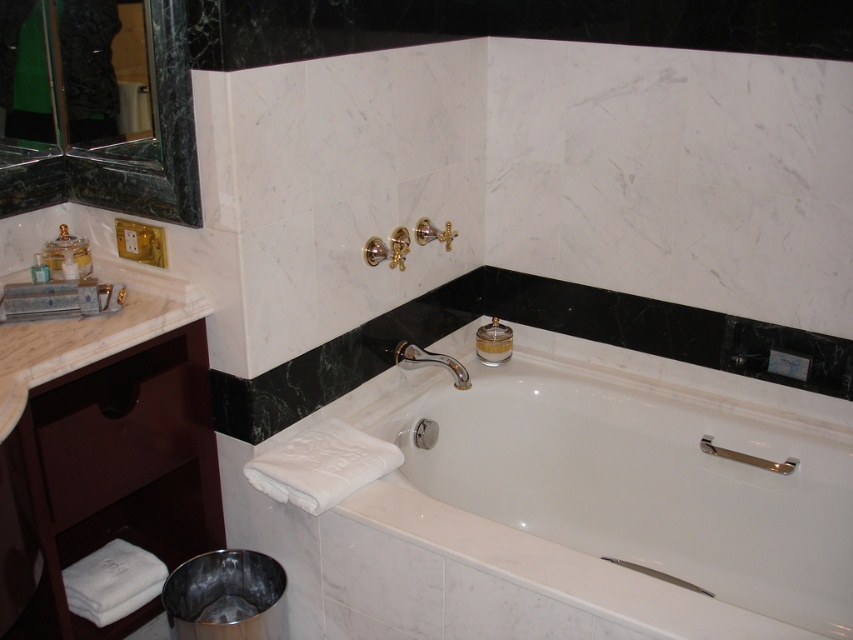
Which is above, white glossy bathtub at center or chrome metallic grab bar at lower right?

chrome metallic grab bar at lower right

What do you see at coordinates (602, 508) in the screenshot? This screenshot has width=853, height=640. I see `white glossy bathtub at center` at bounding box center [602, 508].

This screenshot has height=640, width=853. I want to click on white glossy bathtub at center, so click(602, 508).

Who is taller, white glossy bathtub at center or polished chrome faucet at upper center?

white glossy bathtub at center is taller.

Is white glossy bathtub at center shorter than polished chrome faucet at upper center?

In fact, white glossy bathtub at center may be taller than polished chrome faucet at upper center.

The image size is (853, 640). In order to click on white glossy bathtub at center in this screenshot , I will do `click(602, 508)`.

Who is lower down, polished chrome faucet at upper center or matte gold soap at left?

polished chrome faucet at upper center is below.

Does polished chrome faucet at upper center appear under matte gold soap at left?

Yes.

Who is more distant from viewer, [461,378] or [74,260]?

The point [461,378] is more distant.

Where is `polished chrome faucet at upper center`? Image resolution: width=853 pixels, height=640 pixels. polished chrome faucet at upper center is located at coordinates (430, 362).